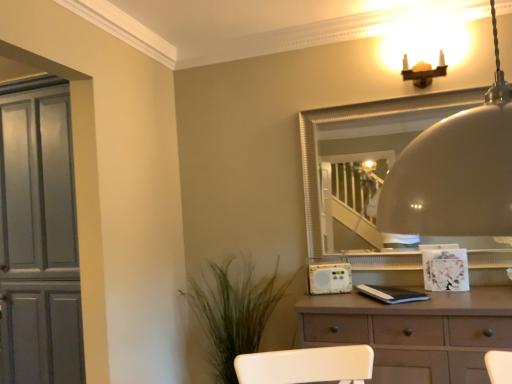
Question: Is point (209, 288) closer or farther from the camera than point (418, 122)?

Choices:
 (A) closer
 (B) farther

Answer: (B)

Question: Is green leafy plant at lower left bigger or smaller than silver textured mirror at upper center?

Choices:
 (A) small
 (B) big

Answer: (B)

Question: Based on their relative distances, which object is farther from the silver textured mirror at upper center?

Choices:
 (A) matte gray cabinet at left
 (B) brown matte chest of drawers at center
 (C) green leafy plant at lower left
 (D) white plastic radio at center

Answer: (A)

Question: Which is nearer to the white plastic radio at center?

Choices:
 (A) brown matte chest of drawers at center
 (B) silver textured mirror at upper center
 (C) green leafy plant at lower left
 (D) matte gray cabinet at left

Answer: (A)